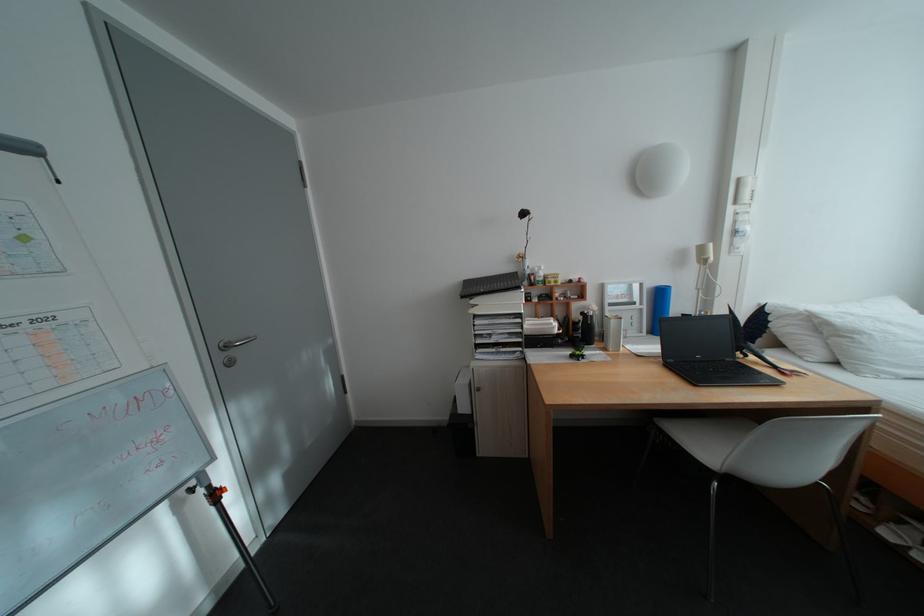
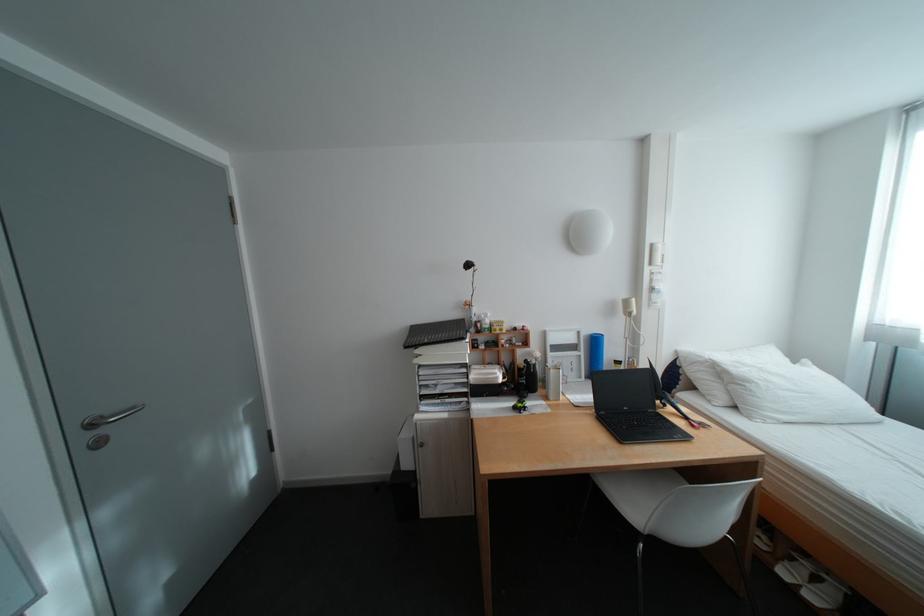
Where in the second image is the point corresponding to point 574,331 from the first image?

(518, 381)